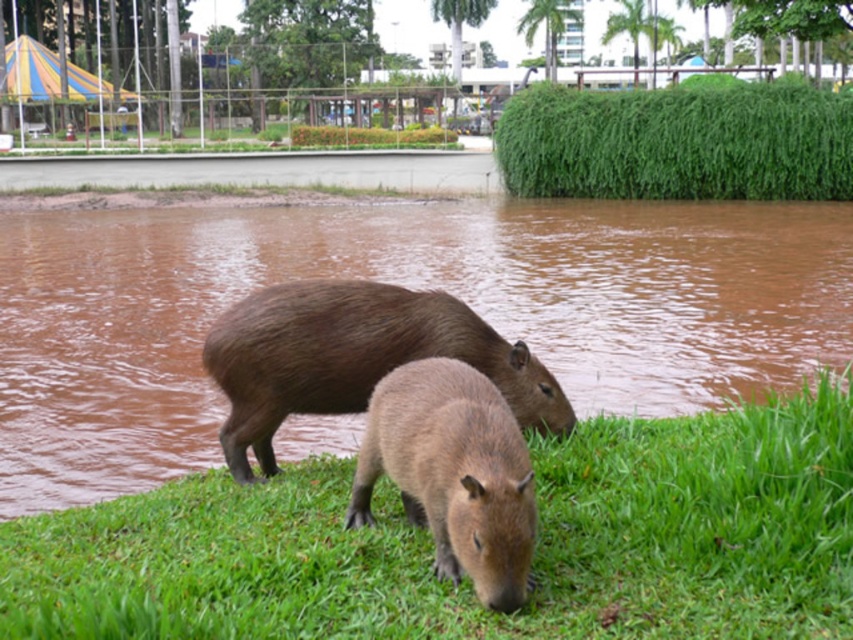
Question: Can you confirm if green grass at lower center is positioned below green leafy grass at upper center?

Choices:
 (A) no
 (B) yes

Answer: (B)

Question: Which object is farther from the camera taking this photo?

Choices:
 (A) brown fur capybara at lower center
 (B) green leafy grass at upper center

Answer: (B)

Question: Is brown fur capybara at lower center closer to camera compared to green grass at lower center?

Choices:
 (A) no
 (B) yes

Answer: (A)

Question: Can you confirm if brown fur capybara at lower center is smaller than green grass at lower center?

Choices:
 (A) no
 (B) yes

Answer: (A)

Question: Which of these objects is positioned closest to the green grass at lower center?

Choices:
 (A) brown furry capybara at center
 (B) green leafy grass at upper center
 (C) brown furry capybara at lower center

Answer: (C)

Question: Which object is closer to the camera taking this photo?

Choices:
 (A) green leafy grass at upper center
 (B) brown fur capybara at lower center
 (C) brown furry capybara at lower center
 (D) brown furry capybara at center

Answer: (C)